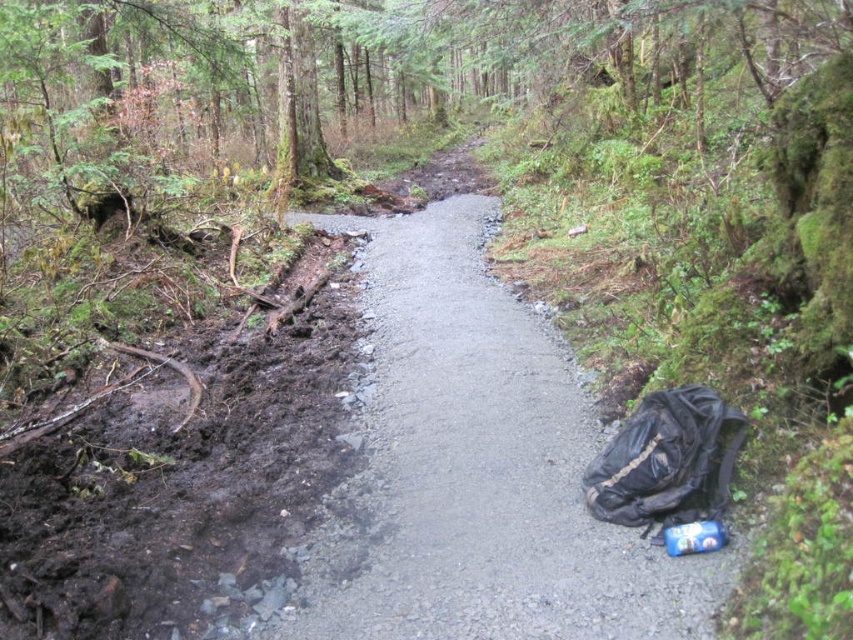
Who is positioned more to the left, dark brown mud at lower left or black fabric backpack at lower right?

dark brown mud at lower left is more to the left.

Between point (113, 406) and point (704, 412), which one is positioned in front?

Point (704, 412) is in front.

Is point (276, 340) positioned behind point (666, 480)?

That is True.

Where is `dark brown mud at lower left`? This screenshot has width=853, height=640. dark brown mud at lower left is located at coordinates (184, 470).

Can you confirm if gray asphalt path at center is smaller than dark brown mud at lower left?

No.

Between gray asphalt path at center and dark brown mud at lower left, which one is positioned lower?

dark brown mud at lower left

Is point (408, 214) positioned before point (314, 508)?

No, (408, 214) is behind (314, 508).

At what (x,y) coordinates should I click in order to perform the action: click on gray asphalt path at center. Please return your answer as a coordinate pair (x, y). Looking at the image, I should click on (486, 465).

Between gray asphalt path at center and black fabric backpack at lower right, which one appears on the right side from the viewer's perspective?

black fabric backpack at lower right is more to the right.

Describe the element at coordinates (486, 465) in the screenshot. I see `gray asphalt path at center` at that location.

Where is `gray asphalt path at center`? gray asphalt path at center is located at coordinates (486, 465).